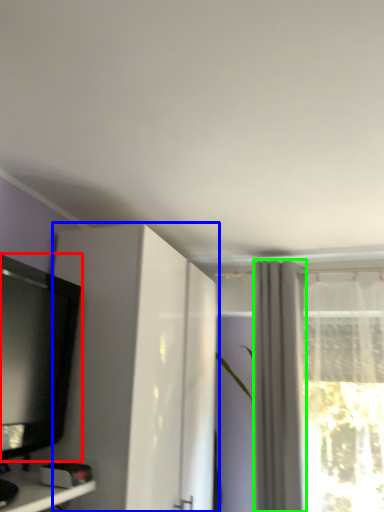
Question: Which object is the closest to the television (highlighted by a red box)? Choose among these: cabinetry (highlighted by a blue box) or curtain (highlighted by a green box).

Choices:
 (A) cabinetry
 (B) curtain

Answer: (A)